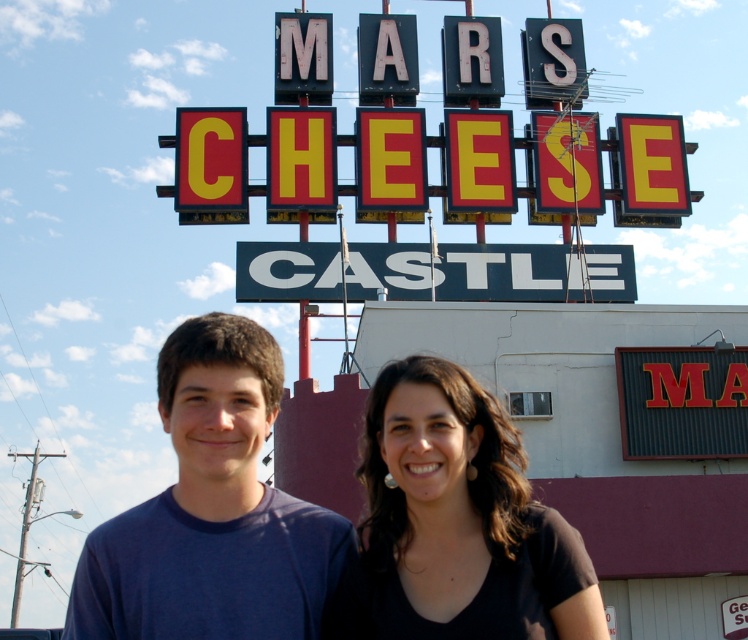
Looking at this image, you are a photographer taking a picture of the black matte hair at center and the black metal sign at center. Which object will appear larger in your photo?

The black matte hair at center will appear larger in the photo because it is closer to the viewer than the black metal sign at center.

You are a photographer trying to capture the sign of the Mars Cheese Castle. You notice a point at coordinate [456,524] in the image. What object or feature is located at this coordinate?

The point at coordinate [456,524] indicates black matte hair at center.